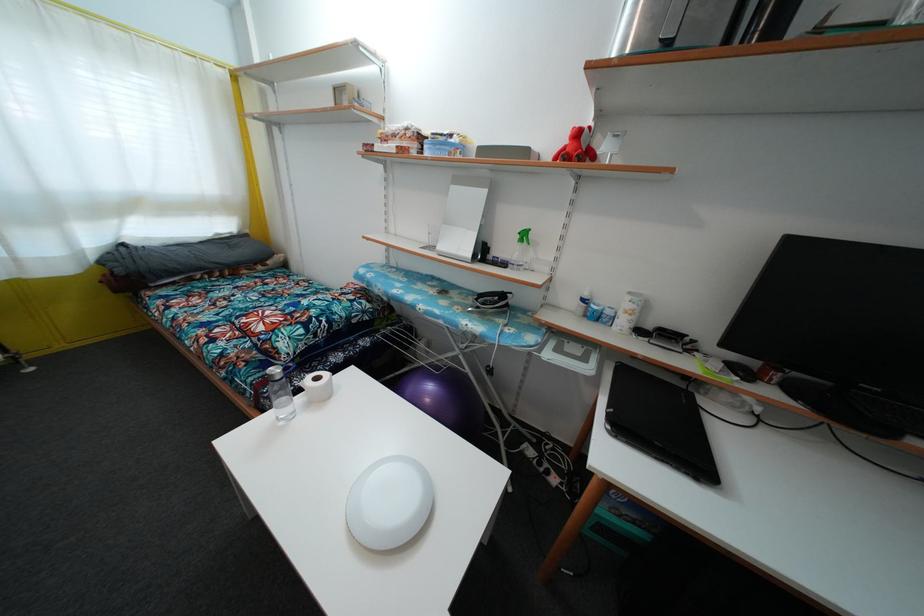
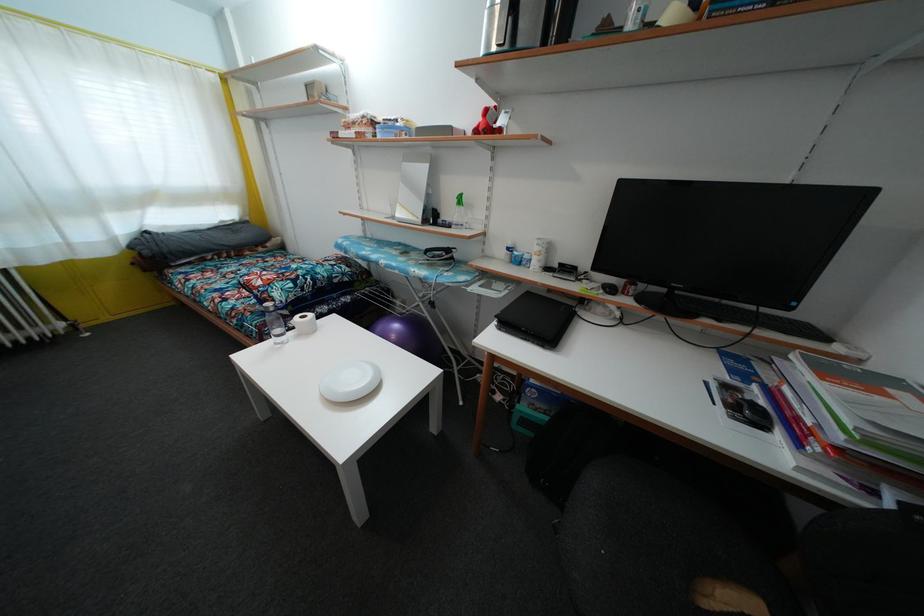
The point at (282, 384) is marked in the first image. Where is the corresponding point in the second image?

(275, 315)